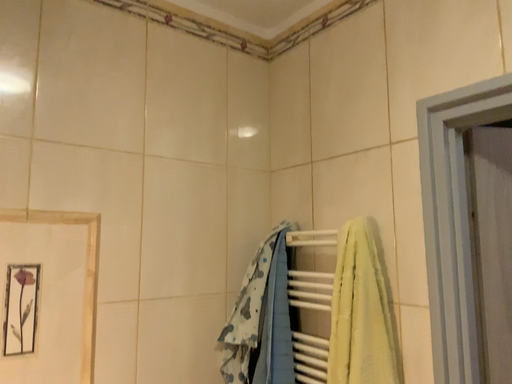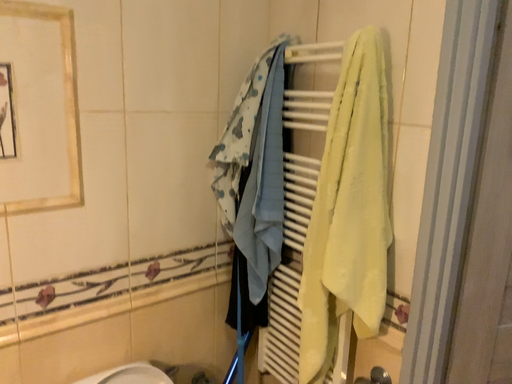
Question: Which way did the camera rotate in the video?

Choices:
 (A) rotated upward
 (B) rotated downward

Answer: (B)